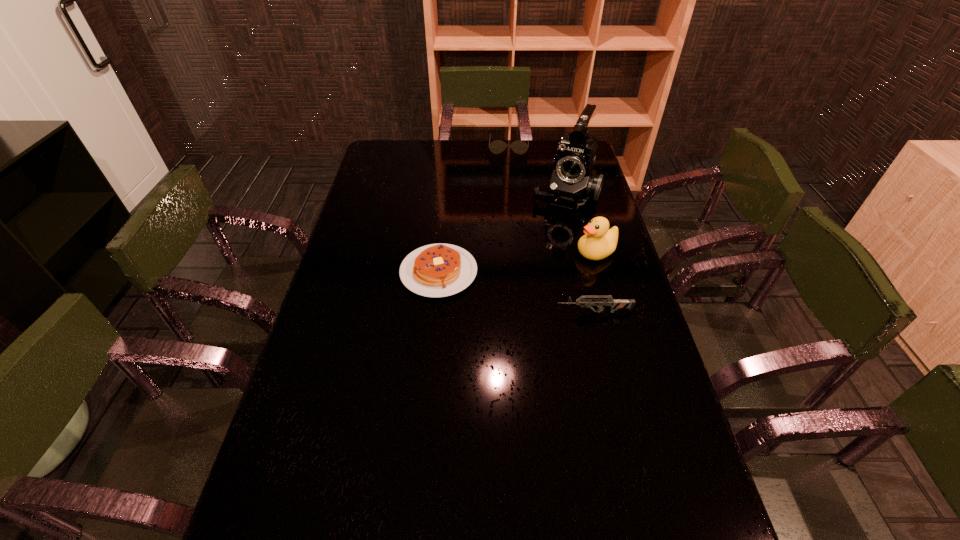
Where is `pancake`? The height and width of the screenshot is (540, 960). pancake is located at coordinates (437, 270).

Identify the location of the leftmost object. (437, 270).

Where is `the nearest object`? This screenshot has width=960, height=540. the nearest object is located at coordinates (615, 304).

This screenshot has width=960, height=540. I want to click on the fourth shortest object, so click(599, 241).

Where is `the tallest object`? The height and width of the screenshot is (540, 960). the tallest object is located at coordinates (573, 181).

This screenshot has width=960, height=540. Find the location of `camcorder`. camcorder is located at coordinates (573, 181).

The height and width of the screenshot is (540, 960). I want to click on sunglasses, so click(520, 147).

Locate an element on the screen. The image size is (960, 540). vacant area situated on the front of the shortest object is located at coordinates (429, 370).

Where is `vacant space situated 0.230m aimed along the barrel of the gun`? vacant space situated 0.230m aimed along the barrel of the gun is located at coordinates (476, 312).

You are a GUI agent. You are given a task and a screenshot of the screen. Output one action in this format:
    pyautogui.click(x=<x>, y=<y>)
    Task: Click on the free region located 0.290m aimed along the barrel of the gun
    Image resolution: width=960 pixels, height=540 pixels.
    Given the screenshot: What is the action you would take?
    pyautogui.click(x=455, y=312)